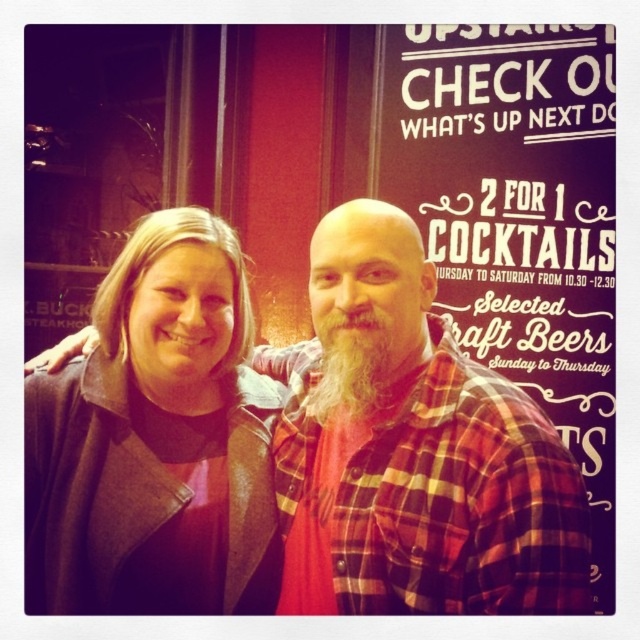
You are taking a photo of the two people in the scene. You want to focus on the person closer to the camera. Which point should you focus on, point (326,269) or point (195,460)?

Point (326,269) is in front of point (195,460), so you should focus on point (326,269) to capture the person closer to the camera.

Consider the image. You are a fashion designer observing two garments in the scene. The plaid flannel shirt at center and the dark brown leather jacket at center. Which garment is taller when viewed from the front?

The plaid flannel shirt at center is taller than the dark brown leather jacket at center.